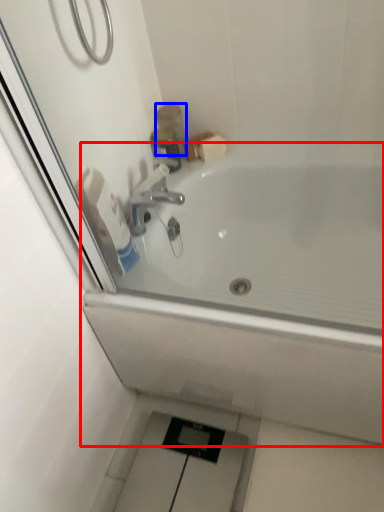
Question: Which object appears closest to the camera in this image, bathtub (highlighted by a red box) or toiletry (highlighted by a blue box)?

Choices:
 (A) bathtub
 (B) toiletry

Answer: (A)